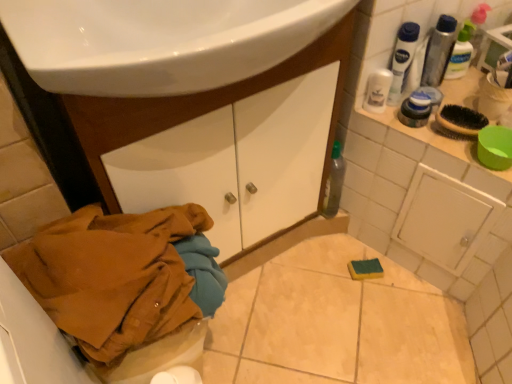
Where is `brown cotton jacket at lower left`? This screenshot has width=512, height=384. brown cotton jacket at lower left is located at coordinates point(121,276).

At what (x,y) coordinates should I click in order to perform the action: click on translucent plastic mouthwash at upper right, the third mouthwash positioned from the left. Please return your answer as a coordinate pair (x, y). This screenshot has width=512, height=384. Looking at the image, I should click on (439, 51).

At what (x,y) coordinates should I click in order to perform the action: click on matte black shaving cream at upper right. Please return your answer as a coordinate pair (x, y). Looking at the image, I should click on (415, 110).

The width and height of the screenshot is (512, 384). What are the coordinates of `brown cotton jacket at lower left` in the screenshot? It's located at (121, 276).

Considering the relative sizes of white plastic mouthwash at upper right, marked as the first mouthwash in a left-to-right arrangement, and matte black shaving cream at upper right in the image provided, is white plastic mouthwash at upper right, marked as the first mouthwash in a left-to-right arrangement, bigger than matte black shaving cream at upper right?

Incorrect, white plastic mouthwash at upper right, marked as the first mouthwash in a left-to-right arrangement, is not larger than matte black shaving cream at upper right.

In terms of width, does white plastic mouthwash at upper right, marked as the first mouthwash in a left-to-right arrangement, look wider or thinner when compared to matte black shaving cream at upper right?

white plastic mouthwash at upper right, marked as the first mouthwash in a left-to-right arrangement, is thinner than matte black shaving cream at upper right.

Locate an element on the screen. Image resolution: width=512 pixels, height=384 pixels. the 1st mouthwash directly above the matte black shaving cream at upper right (from a real-world perspective) is located at coordinates (377, 90).

From the picture: Does white plastic mouthwash at upper right, which is the 2th mouthwash from left to right, turn towards matte black shaving cream at upper right?

Yes, white plastic mouthwash at upper right, which is the 2th mouthwash from left to right, faces towards matte black shaving cream at upper right.

How many degrees apart are the facing directions of white plastic mouthwash at upper right, acting as the 3th mouthwash starting from the right, and matte black shaving cream at upper right?

There is a 0.000658-degree angle between the facing directions of white plastic mouthwash at upper right, acting as the 3th mouthwash starting from the right, and matte black shaving cream at upper right.

From a real-world perspective, relative to matte black shaving cream at upper right, is white plastic mouthwash at upper right, acting as the 3th mouthwash starting from the right, vertically above or below?

white plastic mouthwash at upper right, acting as the 3th mouthwash starting from the right, is situated higher than matte black shaving cream at upper right in the real world.

The height and width of the screenshot is (384, 512). I want to click on toiletry below the white plastic mouthwash at upper right, which is the 2th mouthwash from left to right (from a real-world perspective), so point(415,110).

Is there a large distance between brown cotton jacket at lower left and white plastic mouthwash at upper right, acting as the 3th mouthwash starting from the right?

No, brown cotton jacket at lower left is not far away from white plastic mouthwash at upper right, acting as the 3th mouthwash starting from the right.

Which of these two, brown cotton jacket at lower left or white plastic mouthwash at upper right, acting as the 3th mouthwash starting from the right, stands taller?

Standing taller between the two is brown cotton jacket at lower left.

Considering the sizes of objects translucent plastic mouthwash at upper right, positioned as the 2th mouthwash in right-to-left order, and white plastic mouthwash at upper right, acting as the 3th mouthwash starting from the right, in the image provided, who is shorter, translucent plastic mouthwash at upper right, positioned as the 2th mouthwash in right-to-left order, or white plastic mouthwash at upper right, acting as the 3th mouthwash starting from the right,?

translucent plastic mouthwash at upper right, positioned as the 2th mouthwash in right-to-left order, is shorter.

From the image's perspective, which one is positioned higher, translucent plastic mouthwash at upper right, positioned as the 2th mouthwash in right-to-left order, or white plastic mouthwash at upper right, acting as the 3th mouthwash starting from the right?

translucent plastic mouthwash at upper right, positioned as the 2th mouthwash in right-to-left order, appears higher in the image.

Considering the positions of objects translucent plastic mouthwash at upper right, the third mouthwash positioned from the left, and white plastic mouthwash at upper right, which is the 2th mouthwash from left to right, in the image provided, who is more to the right, translucent plastic mouthwash at upper right, the third mouthwash positioned from the left, or white plastic mouthwash at upper right, which is the 2th mouthwash from left to right,?

Positioned to the right is translucent plastic mouthwash at upper right, the third mouthwash positioned from the left.

Is translucent plastic mouthwash at upper right, the third mouthwash positioned from the left, next to white plastic mouthwash at upper right, acting as the 3th mouthwash starting from the right?

Yes, the surface of translucent plastic mouthwash at upper right, the third mouthwash positioned from the left, is in contact with white plastic mouthwash at upper right, acting as the 3th mouthwash starting from the right.

Is white plastic mouthwash at upper right, acting as the 4th mouthwash starting from the right, taller or shorter than translucent plastic mouthwash at upper right, which appears as the fourth mouthwash when viewed from the left?

Clearly, white plastic mouthwash at upper right, acting as the 4th mouthwash starting from the right, is shorter compared to translucent plastic mouthwash at upper right, which appears as the fourth mouthwash when viewed from the left.

Is white plastic mouthwash at upper right, acting as the 4th mouthwash starting from the right, completely or partially outside of translucent plastic mouthwash at upper right, which appears as the fourth mouthwash when viewed from the left?

Yes.

From a real-world perspective, who is located higher, white plastic mouthwash at upper right, acting as the 4th mouthwash starting from the right, or translucent plastic mouthwash at upper right, which appears as the fourth mouthwash when viewed from the left?

translucent plastic mouthwash at upper right, which appears as the fourth mouthwash when viewed from the left, from a real-world perspective.

Which point is more forward, [364,104] or [462,29]?

The point [364,104] is closer to the camera.

Looking at this image, which is farther from the camera, (x=412, y=122) or (x=442, y=25)?

The point (x=412, y=122) is more distant.

From the image's perspective, is matte black shaving cream at upper right on top of translucent plastic mouthwash at upper right, the third mouthwash positioned from the left?

No, from the image's perspective, matte black shaving cream at upper right is not on top of translucent plastic mouthwash at upper right, the third mouthwash positioned from the left.

Considering the positions of objects matte black shaving cream at upper right and translucent plastic mouthwash at upper right, positioned as the 2th mouthwash in right-to-left order, in the image provided, who is in front, matte black shaving cream at upper right or translucent plastic mouthwash at upper right, positioned as the 2th mouthwash in right-to-left order,?

matte black shaving cream at upper right is in front.

Between matte black shaving cream at upper right and translucent plastic mouthwash at upper right, positioned as the 2th mouthwash in right-to-left order, which one has more height?

translucent plastic mouthwash at upper right, positioned as the 2th mouthwash in right-to-left order, is taller.

Considering the sizes of objects translucent plastic mouthwash at upper right, positioned as the 2th mouthwash in right-to-left order, and white plastic mouthwash at upper right, marked as the first mouthwash in a left-to-right arrangement, in the image provided, who is thinner, translucent plastic mouthwash at upper right, positioned as the 2th mouthwash in right-to-left order, or white plastic mouthwash at upper right, marked as the first mouthwash in a left-to-right arrangement,?

With smaller width is white plastic mouthwash at upper right, marked as the first mouthwash in a left-to-right arrangement.

Is point (448, 24) closer to viewer compared to point (382, 82)?

No.

Between translucent plastic mouthwash at upper right, the third mouthwash positioned from the left, and white plastic mouthwash at upper right, marked as the first mouthwash in a left-to-right arrangement, which one has smaller size?

With smaller size is white plastic mouthwash at upper right, marked as the first mouthwash in a left-to-right arrangement.

Is translucent plastic mouthwash at upper right, the third mouthwash positioned from the left, positioned with its back to white plastic mouthwash at upper right, marked as the first mouthwash in a left-to-right arrangement?

No, translucent plastic mouthwash at upper right, the third mouthwash positioned from the left, is not facing the opposite direction of white plastic mouthwash at upper right, marked as the first mouthwash in a left-to-right arrangement.

Where is `the 1st mouthwash in front of the matte black shaving cream at upper right`? The image size is (512, 384). the 1st mouthwash in front of the matte black shaving cream at upper right is located at coordinates [377, 90].

Where is `toiletry below the white plastic mouthwash at upper right, acting as the 3th mouthwash starting from the right (from a real-world perspective)`? This screenshot has height=384, width=512. toiletry below the white plastic mouthwash at upper right, acting as the 3th mouthwash starting from the right (from a real-world perspective) is located at coordinates (415, 110).

Which object lies nearer to the anchor point translucent plastic mouthwash at upper right, positioned as the 2th mouthwash in right-to-left order, translucent plastic mouthwash at upper right, placed as the first mouthwash when sorted from right to left, or white plastic mouthwash at upper right, acting as the 4th mouthwash starting from the right?

translucent plastic mouthwash at upper right, placed as the first mouthwash when sorted from right to left, is closer to translucent plastic mouthwash at upper right, positioned as the 2th mouthwash in right-to-left order.

Which object lies nearer to the anchor point matte black shaving cream at upper right, white plastic mouthwash at upper right, which is the 2th mouthwash from left to right, or white plastic mouthwash at upper right, acting as the 4th mouthwash starting from the right?

white plastic mouthwash at upper right, acting as the 4th mouthwash starting from the right, lies closer to matte black shaving cream at upper right than the other object.

Estimate the real-world distances between objects in this image. Which object is further from translucent plastic mouthwash at upper right, which appears as the fourth mouthwash when viewed from the left, brown cotton jacket at lower left or matte black shaving cream at upper right?

brown cotton jacket at lower left is further to translucent plastic mouthwash at upper right, which appears as the fourth mouthwash when viewed from the left.

Based on their spatial positions, is matte black shaving cream at upper right or white plastic mouthwash at upper right, acting as the 4th mouthwash starting from the right, further from translucent plastic mouthwash at upper right, which appears as the fourth mouthwash when viewed from the left?

white plastic mouthwash at upper right, acting as the 4th mouthwash starting from the right.

Based on their spatial positions, is matte black shaving cream at upper right or brown cotton jacket at lower left closer to translucent plastic mouthwash at upper right, positioned as the 2th mouthwash in right-to-left order?

matte black shaving cream at upper right is positioned closer to the anchor translucent plastic mouthwash at upper right, positioned as the 2th mouthwash in right-to-left order.

From the image, which object appears to be nearer to translucent plastic mouthwash at upper right, which appears as the fourth mouthwash when viewed from the left, white plastic mouthwash at upper right, marked as the first mouthwash in a left-to-right arrangement, or translucent plastic mouthwash at upper right, positioned as the 2th mouthwash in right-to-left order?

translucent plastic mouthwash at upper right, positioned as the 2th mouthwash in right-to-left order, lies closer to translucent plastic mouthwash at upper right, which appears as the fourth mouthwash when viewed from the left, than the other object.

When comparing their distances from matte black shaving cream at upper right, does translucent plastic mouthwash at upper right, placed as the first mouthwash when sorted from right to left, or white plastic mouthwash at upper right, marked as the first mouthwash in a left-to-right arrangement, seem closer?

Based on the image, white plastic mouthwash at upper right, marked as the first mouthwash in a left-to-right arrangement, appears to be nearer to matte black shaving cream at upper right.

Based on their spatial positions, is translucent plastic mouthwash at upper right, which appears as the fourth mouthwash when viewed from the left, or matte black shaving cream at upper right further from brown cotton jacket at lower left?

Among the two, translucent plastic mouthwash at upper right, which appears as the fourth mouthwash when viewed from the left, is located further to brown cotton jacket at lower left.

This screenshot has height=384, width=512. What are the coordinates of `toiletry between brown cotton jacket at lower left and translucent plastic mouthwash at upper right, which appears as the fourth mouthwash when viewed from the left, in the horizontal direction` in the screenshot? It's located at (415, 110).

Locate an element on the screen. Image resolution: width=512 pixels, height=384 pixels. mouthwash between white plastic mouthwash at upper right, which is the 2th mouthwash from left to right, and matte black shaving cream at upper right vertically is located at coordinates (377, 90).

Locate an element on the screen. toiletry between white plastic mouthwash at upper right, marked as the first mouthwash in a left-to-right arrangement, and translucent plastic mouthwash at upper right, placed as the first mouthwash when sorted from right to left is located at coordinates (415, 110).

Locate an element on the screen. This screenshot has width=512, height=384. mouthwash between brown cotton jacket at lower left and white plastic mouthwash at upper right, acting as the 3th mouthwash starting from the right, in the horizontal direction is located at coordinates (377, 90).